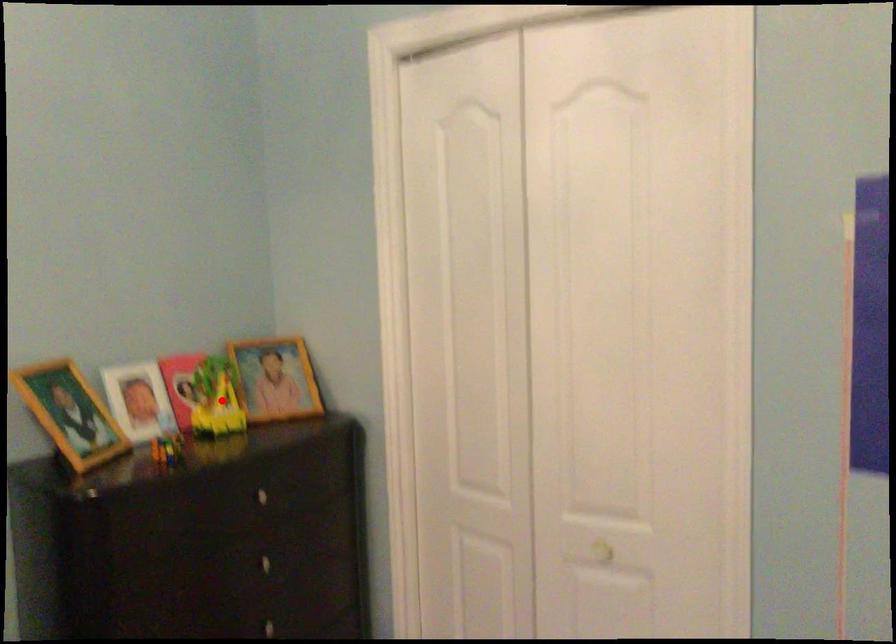
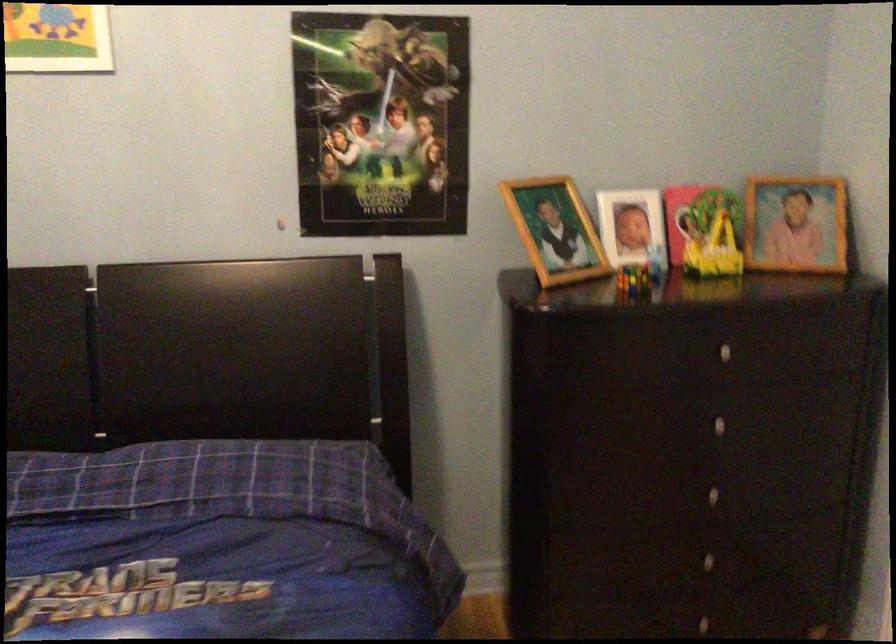
In the second image, find the point that corresponds to the highlighted location in the first image.

(719, 240)